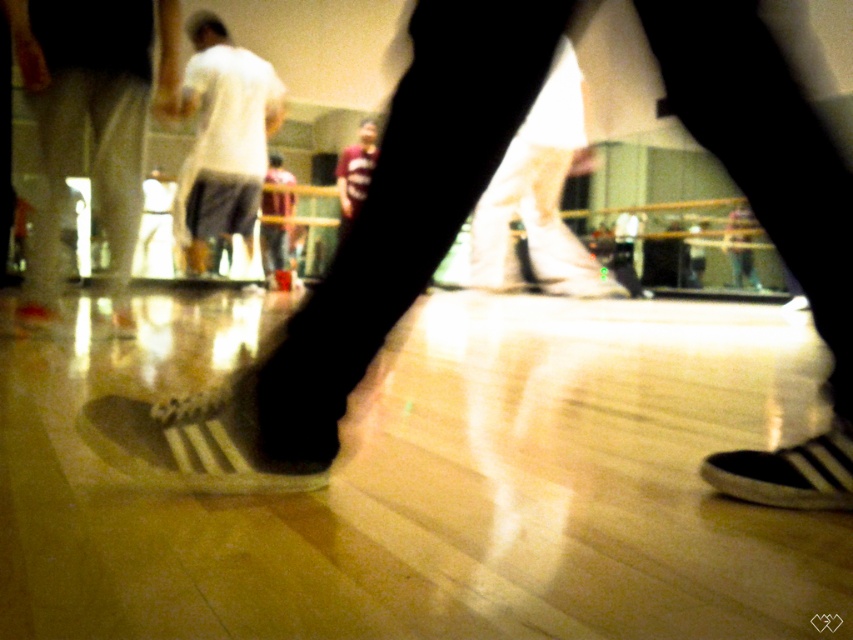
This screenshot has width=853, height=640. What do you see at coordinates (223, 140) in the screenshot?
I see `white matte shirt at center` at bounding box center [223, 140].

Does white matte shirt at center have a lesser width compared to maroon jersey at center?

No.

Find the location of a particular element. The width and height of the screenshot is (853, 640). white matte shirt at center is located at coordinates (223, 140).

You are a GUI agent. You are given a task and a screenshot of the screen. Output one action in this format:
    pyautogui.click(x=<x>, y=<y>)
    Task: Click on the white matte shirt at center
    Image resolution: width=853 pixels, height=640 pixels.
    Given the screenshot: What is the action you would take?
    pyautogui.click(x=223, y=140)

Does point (375, 156) lie behind point (265, 195)?

No, (375, 156) is in front of (265, 195).

Which is above, maroon jersey at center or reddish-brown leather jacket at center?

maroon jersey at center is above.

Which is in front, point (366, 170) or point (271, 170)?

Point (366, 170)

This screenshot has height=640, width=853. What are the coordinates of `maroon jersey at center` in the screenshot? It's located at (355, 172).

Which is above, white matte sneakers at center or black suede shoe at lower right?

Positioned higher is white matte sneakers at center.

Does white matte sneakers at center appear on the right side of black suede shoe at lower right?

No, white matte sneakers at center is not to the right of black suede shoe at lower right.

Does point (57, 150) come closer to viewer compared to point (804, 468)?

No.

This screenshot has height=640, width=853. I want to click on white matte sneakers at center, so [83, 125].